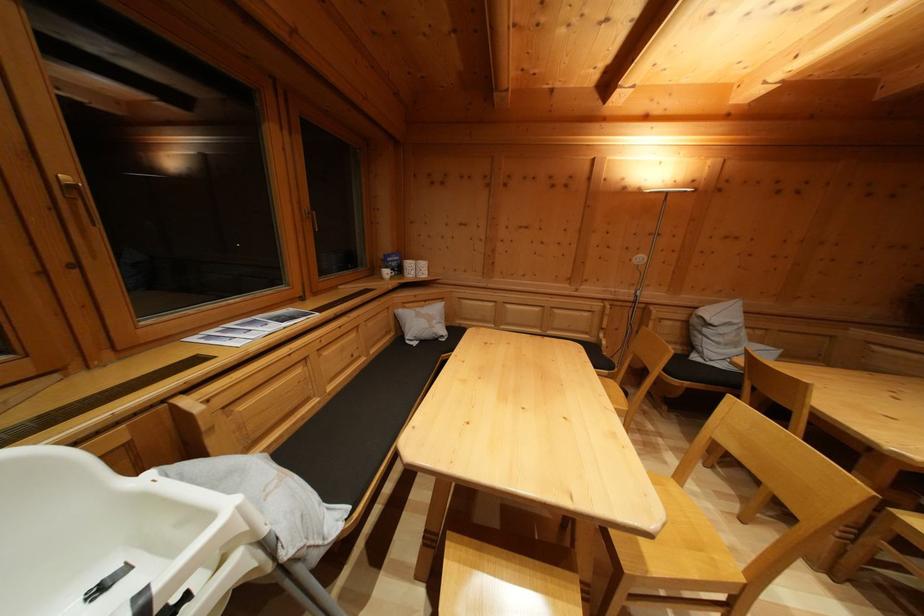
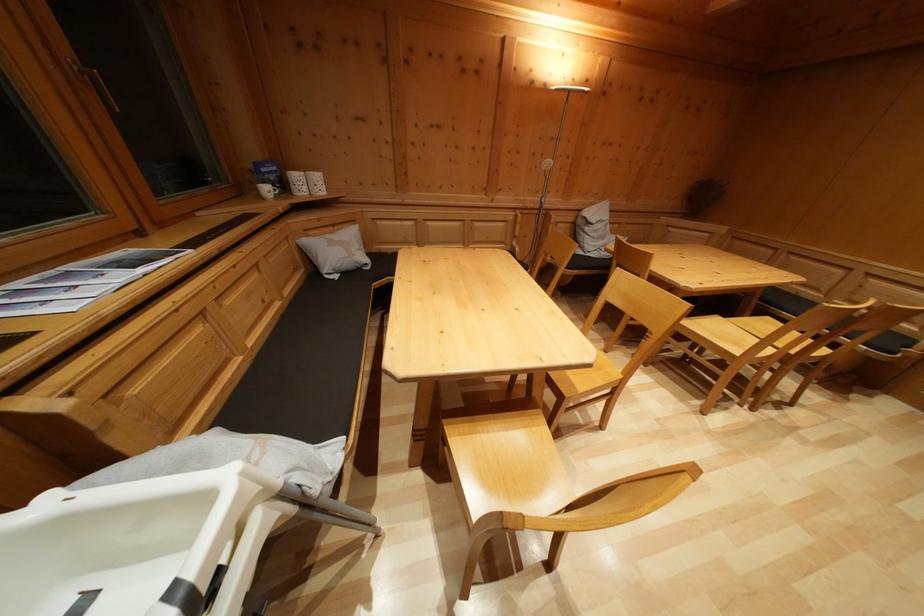
How did the camera likely rotate?

The camera rotated toward right-down.